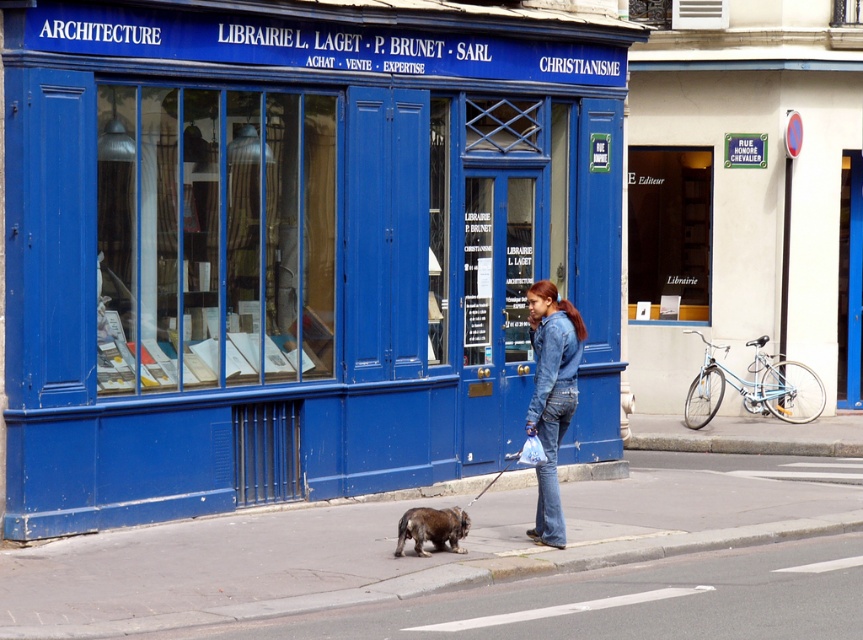
You are a delivery person trying to park your 2.5 meter wide truck in front of the blue painted building at center. The smooth concrete sidewalk at center is the only available space. Can your truck fit there?

The blue painted building at center is bigger than the smooth concrete sidewalk at center, so the truck cannot fit there since the sidewalk is narrower than the truck.

You are a customer looking for a specific book located at the blue storefront with large glass windows and doors. You are currently holding a denim jacket at center. Where should you place the denim jacket to avoid blocking the entrance?

You should place the denim jacket at center away from the entrance to avoid blocking it. Since the denim jacket at center is located at point (551, 396), moving it slightly to the side or behind you would keep the entrance clear.